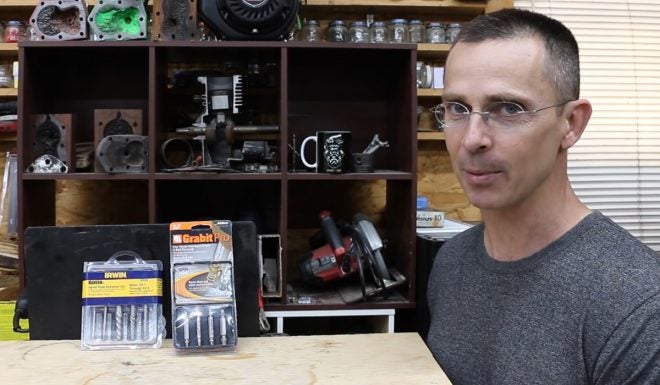
Locate an element on the screen. The height and width of the screenshot is (385, 660). small jars on top shelf is located at coordinates click(x=308, y=32), click(x=335, y=32), click(x=358, y=33), click(x=376, y=35), click(x=404, y=33), click(x=416, y=34), click(x=435, y=33), click(x=459, y=30).